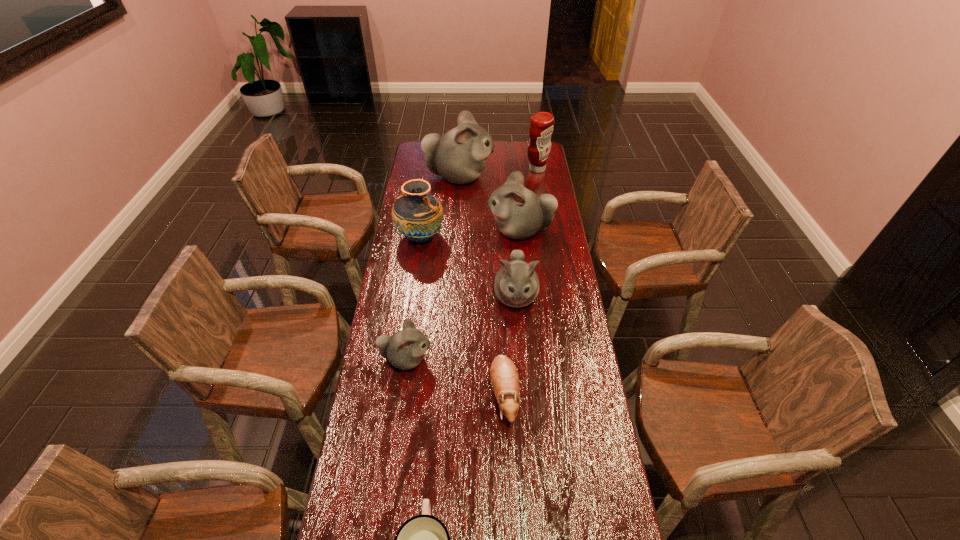
In order to click on brown hamster in this screenshot , I will do `click(504, 377)`.

This screenshot has height=540, width=960. In order to click on free location located on the face of the biggest white hamster in this screenshot , I will do pos(550,177).

Locate an element on the screen. This screenshot has width=960, height=540. free region located 0.230m on the left of the red condiment is located at coordinates (482, 169).

Locate an element on the screen. The height and width of the screenshot is (540, 960). free space located 0.190m on the front of the pottery is located at coordinates (414, 286).

The width and height of the screenshot is (960, 540). What are the coordinates of `free location located 0.170m on the face of the second biggest white hamster` in the screenshot? It's located at (449, 231).

Identify the location of vacant space located 0.200m on the face of the second biggest white hamster. (443, 231).

Identify the location of vacant space located 0.120m on the face of the second biggest white hamster. This screenshot has height=540, width=960. (460, 231).

Image resolution: width=960 pixels, height=540 pixels. I want to click on vacant point located on the face of the third farthest white hamster, so click(x=522, y=388).

The image size is (960, 540). I want to click on free location located on the face of the third shortest object, so 535,359.

Find the location of `vacant space located 0.170m at the face of the shortest hamster`. vacant space located 0.170m at the face of the shortest hamster is located at coordinates (508, 489).